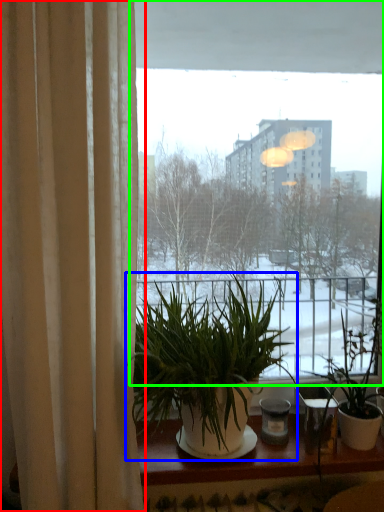
Question: Which object is the farthest from curtain (highlighted by a red box)? Choose among these: houseplant (highlighted by a blue box) or window (highlighted by a green box).

Choices:
 (A) houseplant
 (B) window

Answer: (B)